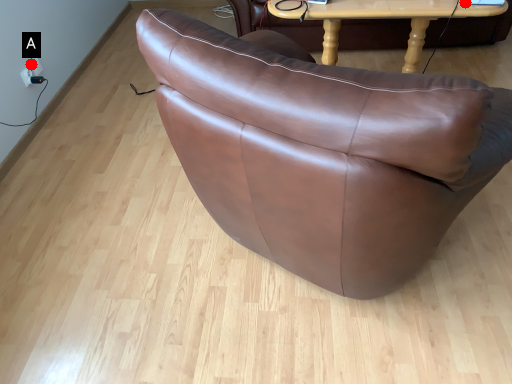
Question: Two points are circled on the image, labeled by A and B beside each circle. Which point is closer to the camera?

Choices:
 (A) A is closer
 (B) B is closer

Answer: (B)